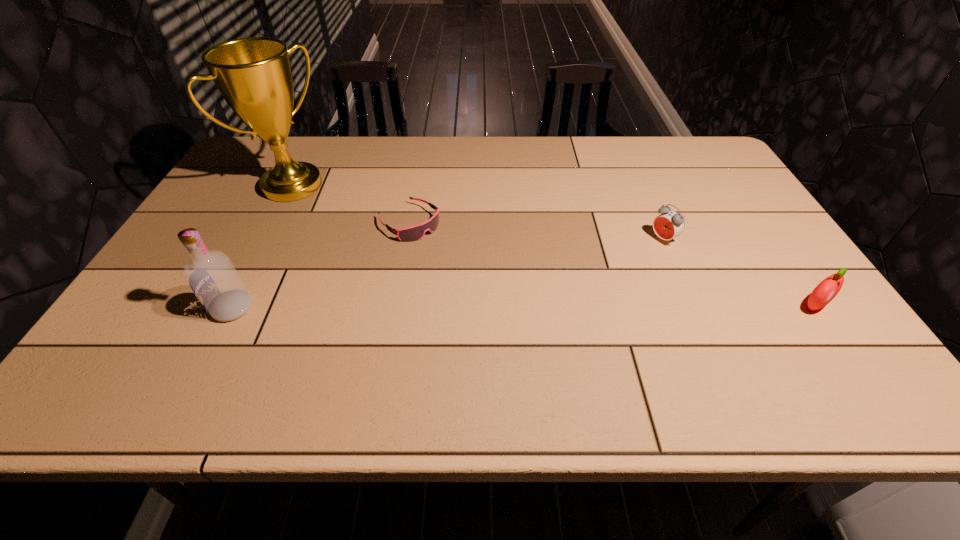
Where is `free space between the apple and the award`? The height and width of the screenshot is (540, 960). free space between the apple and the award is located at coordinates (553, 246).

The width and height of the screenshot is (960, 540). What are the coordinates of `empty space that is in between the goggles and the alarm clock` in the screenshot? It's located at (537, 231).

Locate an element on the screen. The width and height of the screenshot is (960, 540). free space between the second tallest object and the shortest object is located at coordinates (321, 265).

This screenshot has width=960, height=540. What are the coordinates of `vacant region between the alarm clock and the rightmost object` in the screenshot? It's located at (738, 273).

This screenshot has width=960, height=540. I want to click on vacant space that's between the fourth shortest object and the rightmost object, so click(523, 307).

Locate an element on the screen. free area in between the shortest object and the apple is located at coordinates (612, 264).

The image size is (960, 540). In order to click on empty space between the vodka and the award in this screenshot , I will do `click(262, 247)`.

Identify the location of vacant space that's between the rightmost object and the tallest object. The width and height of the screenshot is (960, 540). (553, 246).

At what (x,y) coordinates should I click in order to perform the action: click on free point between the apple and the tallest object. Please return your answer as a coordinate pair (x, y). Looking at the image, I should click on (553, 246).

Where is `vacant area that lies between the goggles and the award`? vacant area that lies between the goggles and the award is located at coordinates (351, 204).